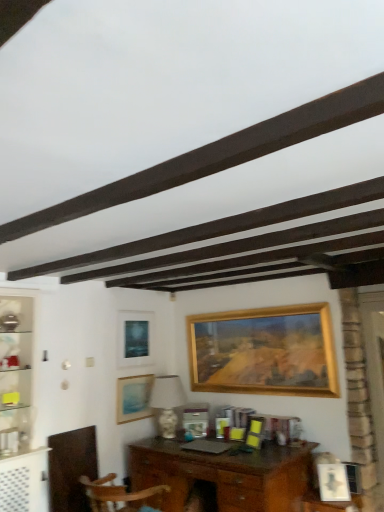
Question: Considering the positions of matte blue picture frame at lower left, which is counted as the 2th picture frame, starting from the left, and wooden picture frame at center, which is the third picture frame in left-to-right order, in the image, is matte blue picture frame at lower left, which is counted as the 2th picture frame, starting from the left, taller or shorter than wooden picture frame at center, which is the third picture frame in left-to-right order,?

Choices:
 (A) tall
 (B) short

Answer: (A)

Question: Is point (147, 401) closer or farther from the camera than point (196, 435)?

Choices:
 (A) closer
 (B) farther

Answer: (B)

Question: Which object is the closest to the matte black picture frame at center, the fifth picture frame from the right?

Choices:
 (A) wooden desk at center
 (B) wooden picture frame at center, placed as the 3th picture frame when sorted from right to left
 (C) white glossy lamp at center
 (D) gold wooden picture frame at center, arranged as the 4th picture frame when viewed from the left
 (E) matte blue picture frame at lower left, placed as the 4th picture frame when sorted from right to left

Answer: (E)

Question: Considering the real-world distances, which object is farthest from the white glossy lamp at center?

Choices:
 (A) matte blue picture frame at lower left, placed as the 4th picture frame when sorted from right to left
 (B) matte black picture frame at center, the fifth picture frame from the right
 (C) wooden desk at center
 (D) wooden picture frame at center, placed as the 3th picture frame when sorted from right to left
 (E) matte white picture frame at lower right, the 5th picture frame in the left-to-right sequence

Answer: (E)